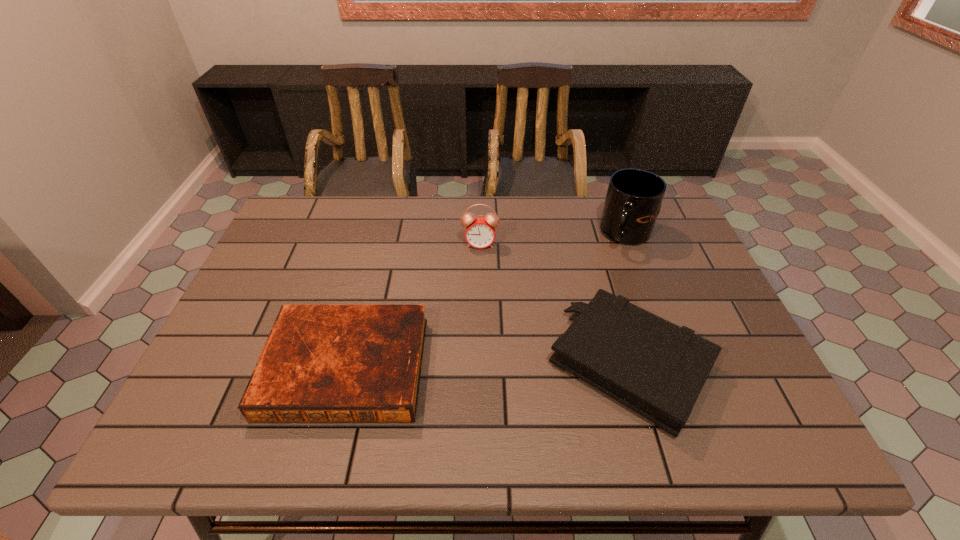
Identify the location of the shorter Bible. (321, 363).

Where is `the leftmost object`? The width and height of the screenshot is (960, 540). the leftmost object is located at coordinates (321, 363).

Find the location of a particular element. the right Bible is located at coordinates (657, 369).

At what (x,y) coordinates should I click in order to perform the action: click on the taller Bible. Please return your answer as a coordinate pair (x, y). Image resolution: width=960 pixels, height=540 pixels. Looking at the image, I should click on (657, 369).

Where is `the tallest object`? Image resolution: width=960 pixels, height=540 pixels. the tallest object is located at coordinates (633, 201).

Locate an element on the screen. alarm clock is located at coordinates (480, 231).

This screenshot has height=540, width=960. What are the coordinates of `the second object from left to right` in the screenshot? It's located at (480, 231).

At what (x,y) coordinates should I click in order to perform the action: click on vacant space located 0.400m on the left of the third tallest object. Please return your answer as a coordinate pair (x, y). Looking at the image, I should click on coord(373,364).

Identify the location of vacant space located 0.050m with the handle on the side of the tallest object. (605, 258).

The height and width of the screenshot is (540, 960). Identify the location of free spot located with the handle on the side of the tallest object. (x=574, y=287).